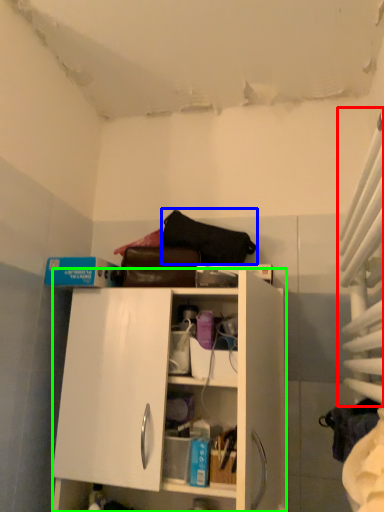
Question: Estimate the real-world distances between objects in this image. Which object is farther from curtain (highlighted by a red box), handbag (highlighted by a blue box) or cabinetry (highlighted by a green box)?

Choices:
 (A) handbag
 (B) cabinetry

Answer: (A)